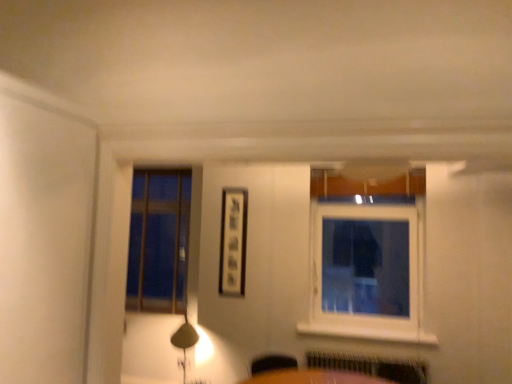
Question: In terms of width, does white plastic window at upper right look wider or thinner when compared to matte black picture frame at center?

Choices:
 (A) thin
 (B) wide

Answer: (B)

Question: Is point (413, 317) closer or farther from the camera than point (222, 236)?

Choices:
 (A) farther
 (B) closer

Answer: (B)

Question: Which object is the farthest from the metallic silver radiator at lower center?

Choices:
 (A) white painted wood at lower center
 (B) matte black picture frame at center
 (C) white plastic window at upper right
 (D) matte gold table lamp at lower left

Answer: (D)

Question: Estimate the real-world distances between objects in this image. Which object is farther from the white painted wood at lower center?

Choices:
 (A) metallic silver radiator at lower center
 (B) matte gold table lamp at lower left
 (C) matte black picture frame at center
 (D) white plastic window at upper right

Answer: (B)